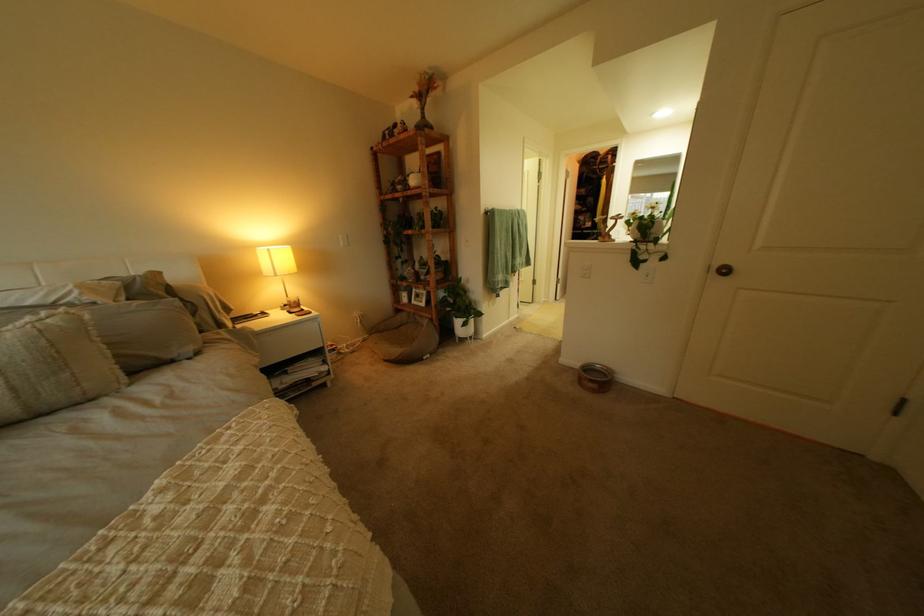
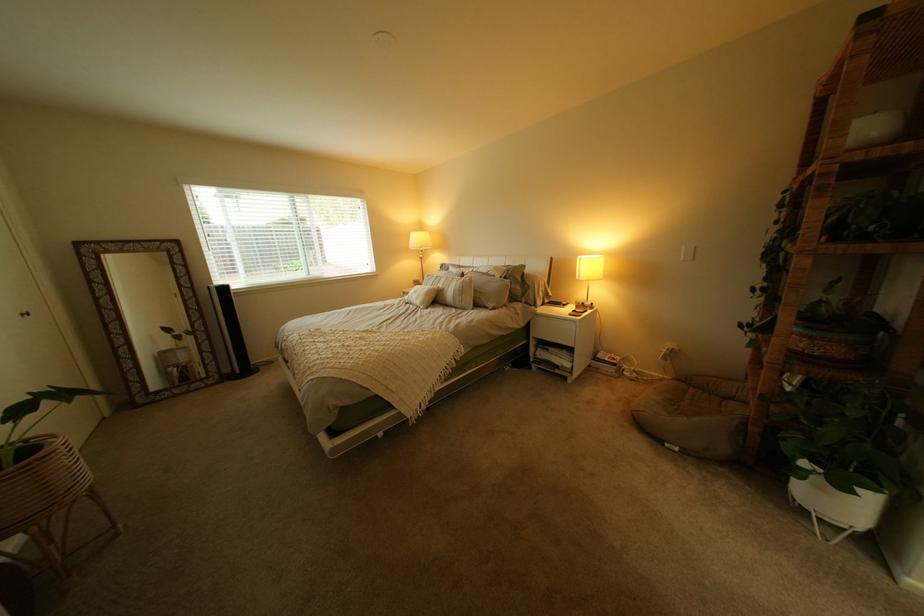
Locate, in the second image, the point that corresponds to (x=213, y=355) in the first image.

(509, 310)